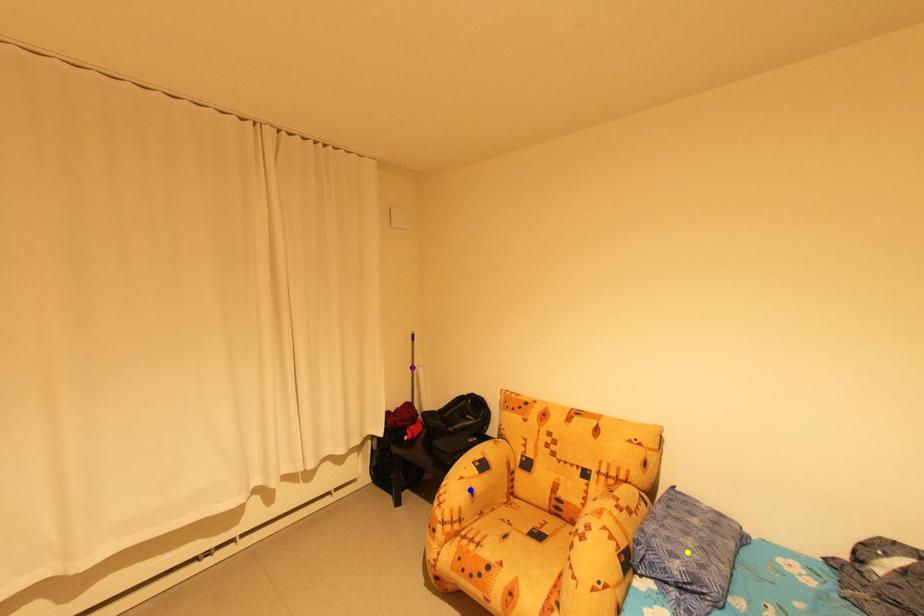
Based on the photo, order these from farthest to nearest:
- blue point
- yellow point
- purple point

1. purple point
2. blue point
3. yellow point